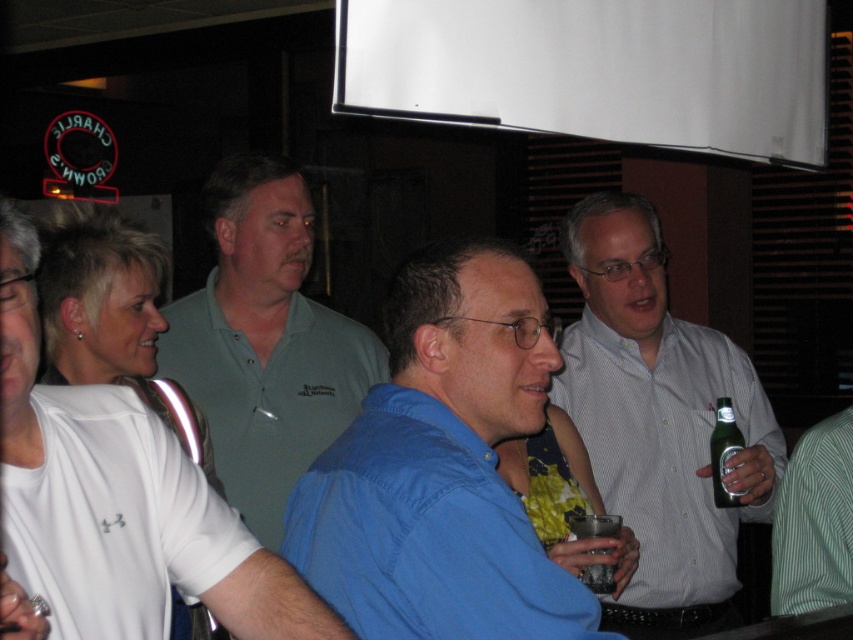
Question: Is light blue shirt at center bigger than green glass bottle at right?

Choices:
 (A) yes
 (B) no

Answer: (A)

Question: Does white matte polo shirt at left have a lesser width compared to green striped polo shirt at right?

Choices:
 (A) yes
 (B) no

Answer: (B)

Question: Which object is positioned farthest from the matte green polo shirt at center?

Choices:
 (A) white matte polo shirt at left
 (B) light blue shirt at center
 (C) green striped polo shirt at right
 (D) blue cotton shirt at center

Answer: (A)

Question: Which object is the farthest from the white matte polo shirt at upper left?

Choices:
 (A) clear plastic cup at center
 (B) white matte polo shirt at left

Answer: (A)

Question: Where is matte green polo shirt at center located in relation to clear plastic cup at center in the image?

Choices:
 (A) above
 (B) below

Answer: (A)

Question: Estimate the real-world distances between objects in this image. Which object is farther from the clear plastic cup at center?

Choices:
 (A) green striped polo shirt at right
 (B) green glass bottle at right
 (C) light blue shirt at center

Answer: (C)